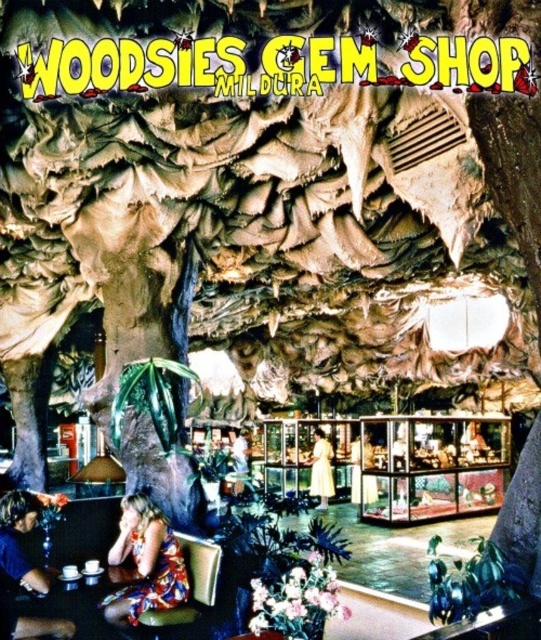
Question: Is blonde hair at lower left bigger than white cotton dress at center?

Choices:
 (A) no
 (B) yes

Answer: (B)

Question: Does blonde hair at lower left appear on the right side of white cotton shirt at center?

Choices:
 (A) no
 (B) yes

Answer: (A)

Question: Among these points, which one is nearest to the camera?

Choices:
 (A) (234, 483)
 (B) (331, 451)

Answer: (A)

Question: Which is farther from the printed fabric dress at lower center?

Choices:
 (A) matte white dress at center
 (B) white cotton shirt at center
 (C) blonde hair at lower left
 (D) white cotton dress at center

Answer: (B)

Question: Among these objects, which one is nearest to the camera?

Choices:
 (A) white cotton dress at center
 (B) blonde hair at lower left

Answer: (B)

Question: Is the position of white cotton dress at center less distant than that of matte white dress at center?

Choices:
 (A) yes
 (B) no

Answer: (A)